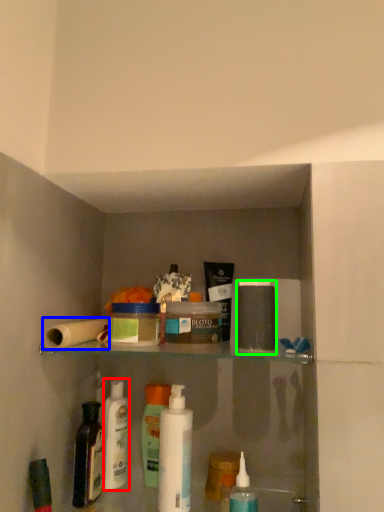
Question: Estimate the real-world distances between objects in this image. Which object is farther from cleaning product (highlighted by a red box), toilet paper (highlighted by a blue box) or toiletry (highlighted by a green box)?

Choices:
 (A) toilet paper
 (B) toiletry

Answer: (B)